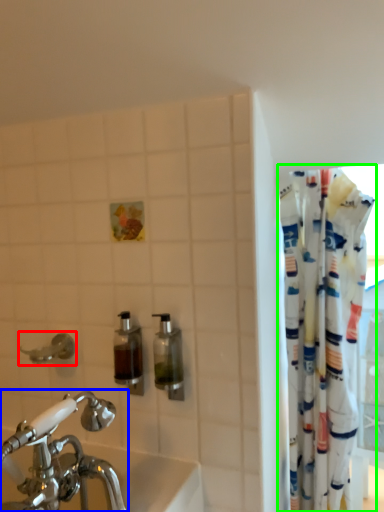
Question: Which is nearer to the plumbing fixture (highlighted by a red box)? tap (highlighted by a blue box) or curtain (highlighted by a green box).

Choices:
 (A) tap
 (B) curtain

Answer: (A)